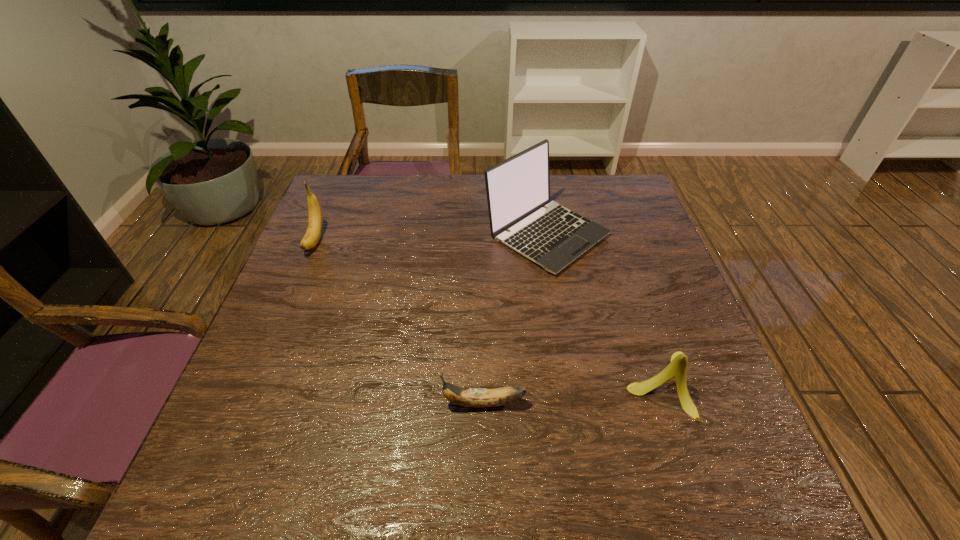
Image resolution: width=960 pixels, height=540 pixels. In order to click on the tallest object in this screenshot , I will do `click(518, 188)`.

Identify the location of the leftmost banana. (315, 221).

Where is `the leftmost object`? Image resolution: width=960 pixels, height=540 pixels. the leftmost object is located at coordinates (315, 221).

This screenshot has width=960, height=540. I want to click on the second shortest object, so click(x=677, y=368).

The image size is (960, 540). What are the coordinates of `the rightmost banana` in the screenshot? It's located at (677, 368).

At what (x,y) coordinates should I click in order to perform the action: click on the shortest banana. Please return your answer as a coordinate pair (x, y). Looking at the image, I should click on (468, 397).

At what (x,y) coordinates should I click in order to perform the action: click on the second banana from left to right. Please return your answer as a coordinate pair (x, y). Looking at the image, I should click on 468,397.

Identify the location of free space located 0.180m at the front screen of the laptop_computer. (564, 334).

Locate an element on the screen. The image size is (960, 540). vacant space situated 0.160m at the start of the peel on the tallest banana is located at coordinates (288, 303).

The width and height of the screenshot is (960, 540). What are the coordinates of `free region located on the left of the rightmost banana` in the screenshot? It's located at (595, 385).